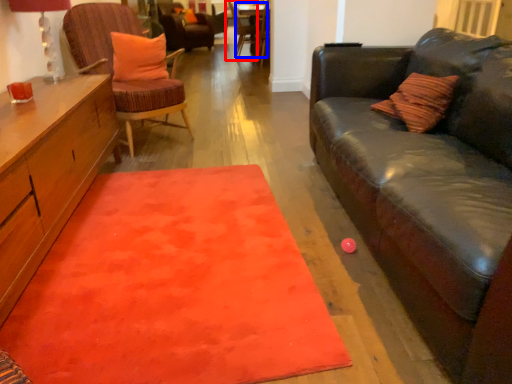
Question: Which of the following is the farthest to the observer, chair (highlighted by a red box) or side table (highlighted by a blue box)?

Choices:
 (A) chair
 (B) side table

Answer: (A)